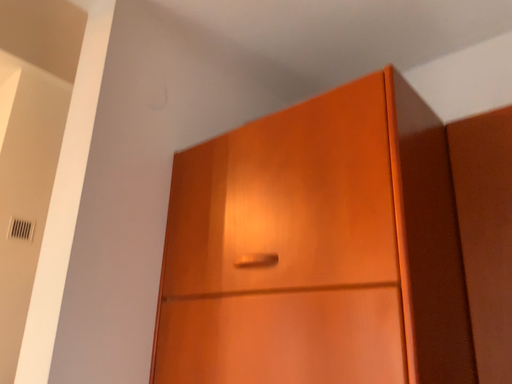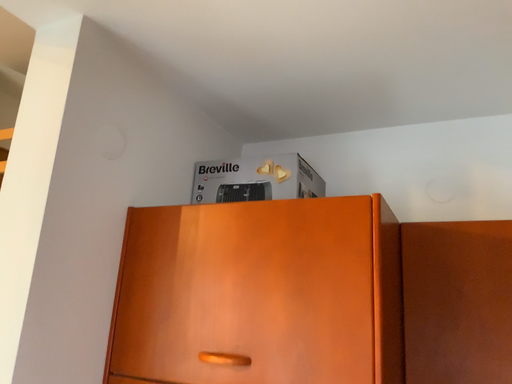
Question: Which way did the camera rotate in the video?

Choices:
 (A) rotated downward
 (B) rotated upward

Answer: (A)